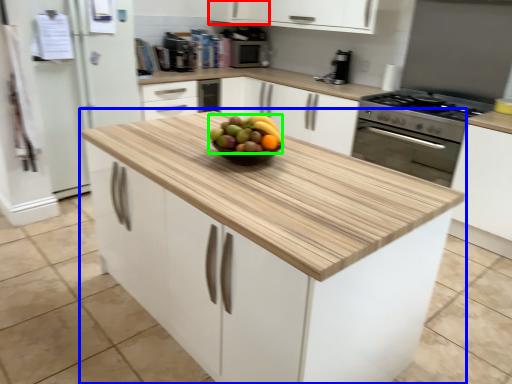
Question: Based on their relative distances, which object is nearer to cabinetry (highlighted by a red box)? Choose from cabinetry (highlighted by a blue box) and grapefruit (highlighted by a green box).

Choices:
 (A) cabinetry
 (B) grapefruit

Answer: (B)